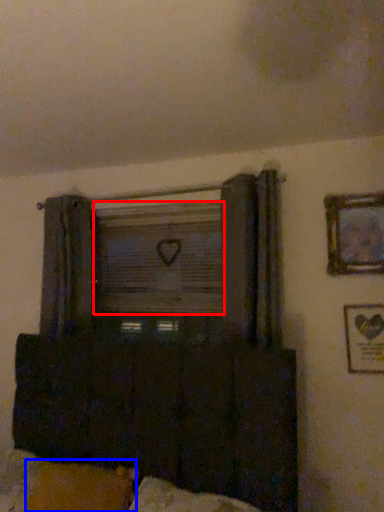
Question: Which of the following is the closest to the observer, window screen (highlighted by a red box) or pillow (highlighted by a blue box)?

Choices:
 (A) window screen
 (B) pillow

Answer: (B)